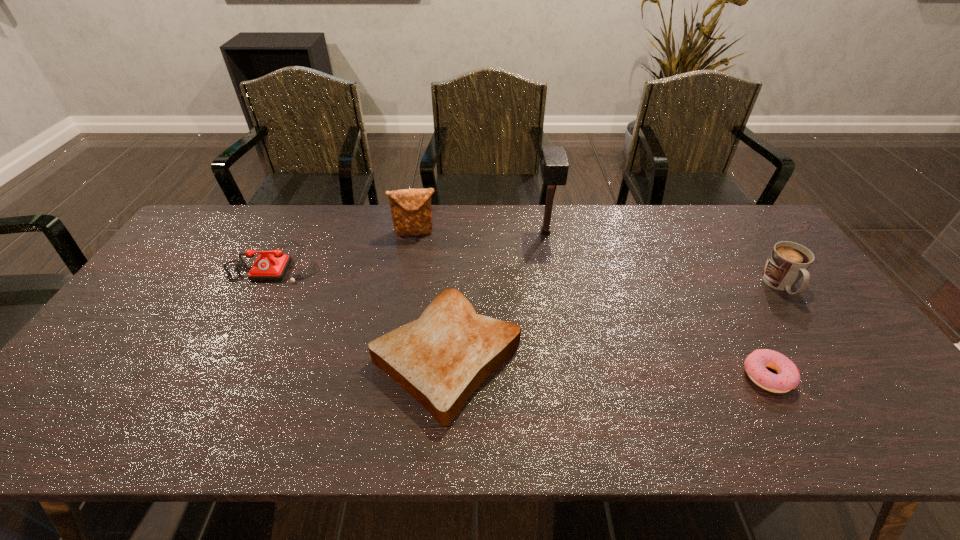
The width and height of the screenshot is (960, 540). What are the coordinates of `blank space located on the front of the tallest object` in the screenshot? It's located at (564, 332).

This screenshot has height=540, width=960. Identify the location of vacant space situated 0.280m on the open side of the clutch bag. (403, 301).

The image size is (960, 540). What are the coordinates of `vacant area situated 0.210m on the side of the fourth shortest object with the handle` in the screenshot? It's located at (838, 366).

You are a GUI agent. You are given a task and a screenshot of the screen. Output one action in this format:
    pyautogui.click(x=<x>, y=<y>)
    Task: Click on the free space located on the dial of the third shortest object
    The width and height of the screenshot is (960, 540).
    Given the screenshot: What is the action you would take?
    pyautogui.click(x=234, y=340)

Where is `vacant space located 0.250m on the back of the fifth tallest object`? The image size is (960, 540). vacant space located 0.250m on the back of the fifth tallest object is located at coordinates (454, 247).

Locate an element on the screen. free space located on the back of the second object from right to left is located at coordinates (742, 332).

The image size is (960, 540). I want to click on mallet present at the far edge, so click(x=554, y=166).

Where is `clutch bag located in the far edge section of the desktop`? Image resolution: width=960 pixels, height=540 pixels. clutch bag located in the far edge section of the desktop is located at coordinates (411, 211).

You are a GUI agent. You are given a task and a screenshot of the screen. Output one action in this format:
    pyautogui.click(x=<x>, y=<y>)
    Task: Click on the telephone that is at the far edge
    The height and width of the screenshot is (540, 960).
    Given the screenshot: What is the action you would take?
    pyautogui.click(x=273, y=266)

Identify the location of object at the near edge. This screenshot has height=540, width=960. (440, 359).